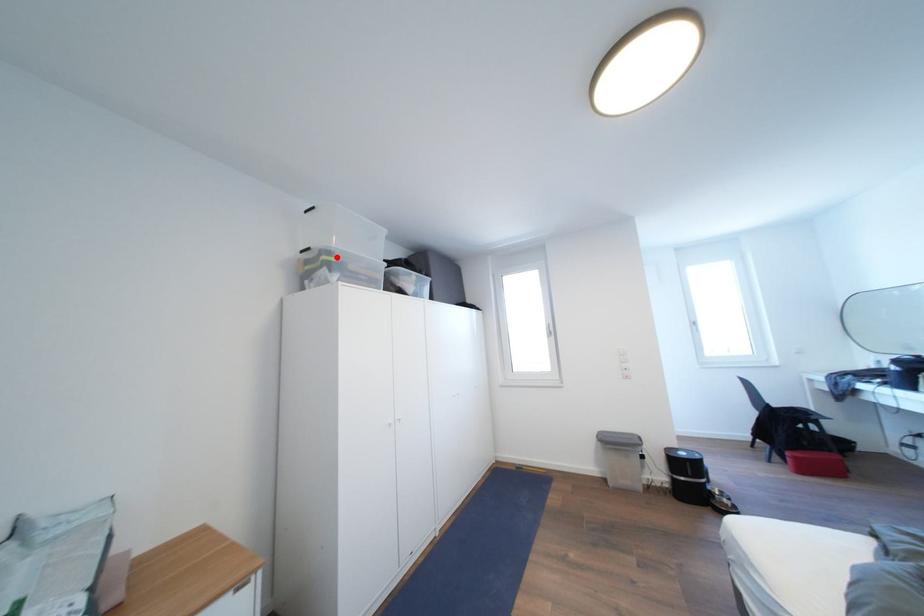
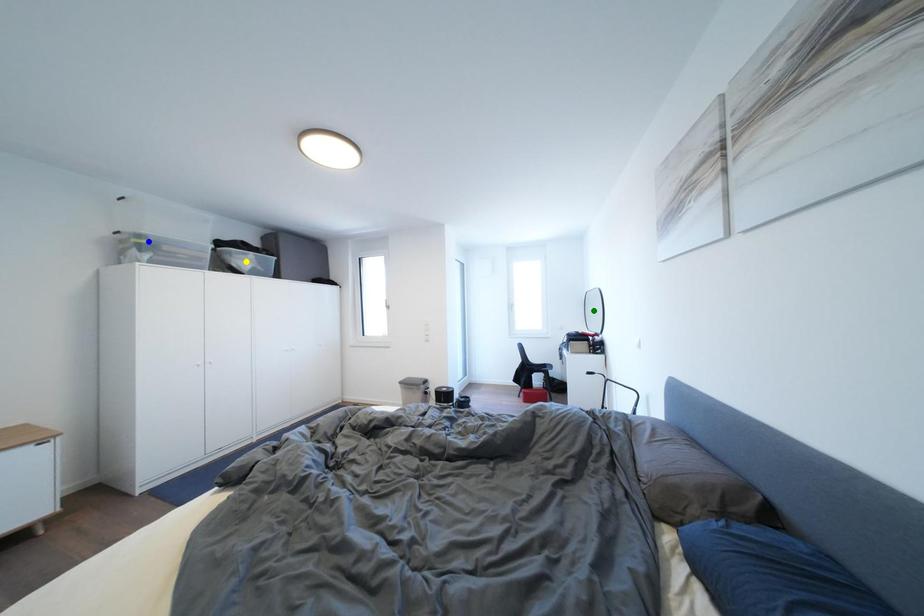
Question: I am providing you with two images of the same scene from different viewpoints. A red point is marked on the first image. You are given multiple points on the second image. Which spot in image 2 lines up with the point in image 1?

Choices:
 (A) yellow point
 (B) blue point
 (C) green point

Answer: (B)